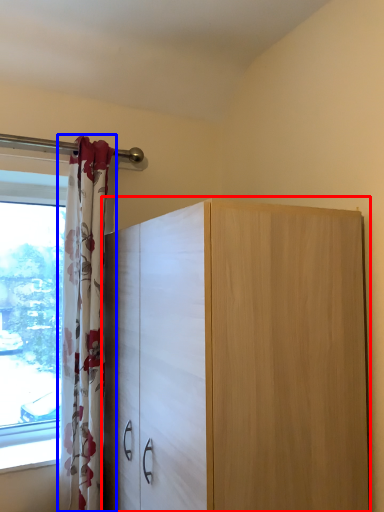
Question: Which object appears closest to the camera in this image, cupboard (highlighted by a red box) or curtain (highlighted by a blue box)?

Choices:
 (A) cupboard
 (B) curtain

Answer: (A)